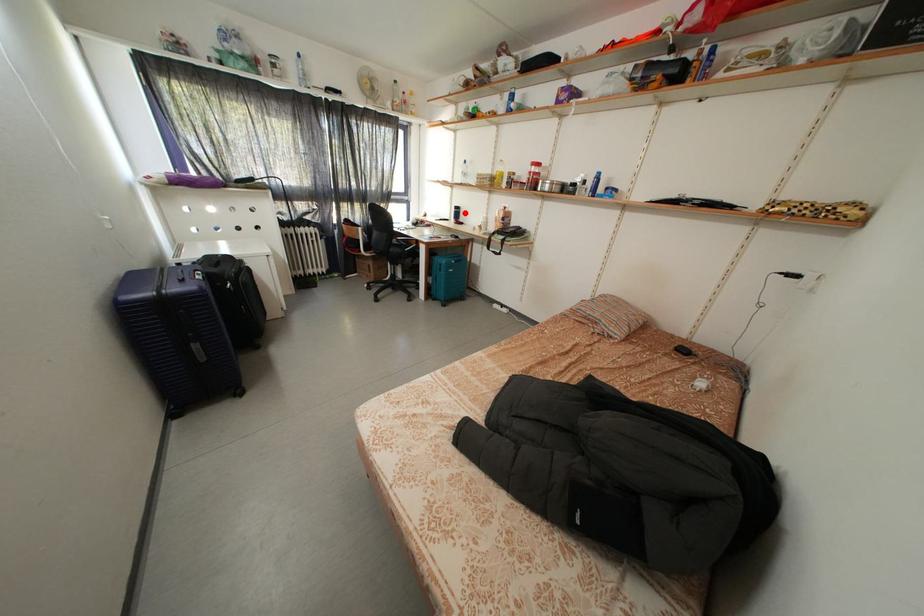
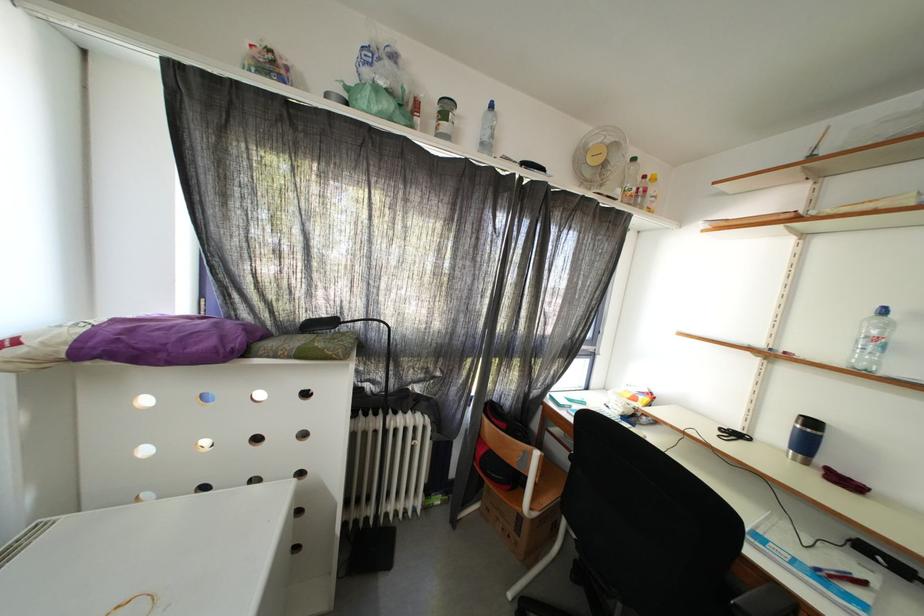
Find the pixel in the second image that matches the highlighted location in the first image.

(820, 429)